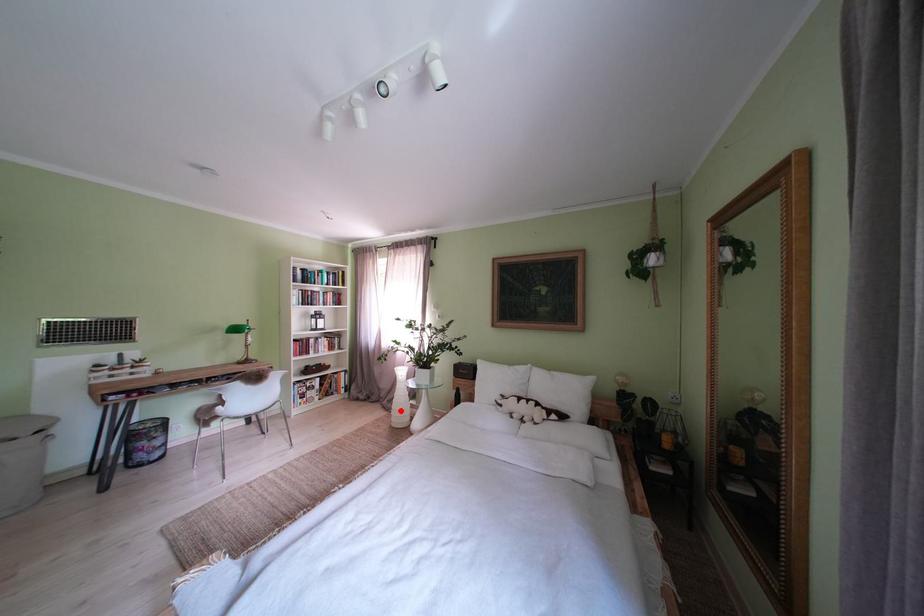
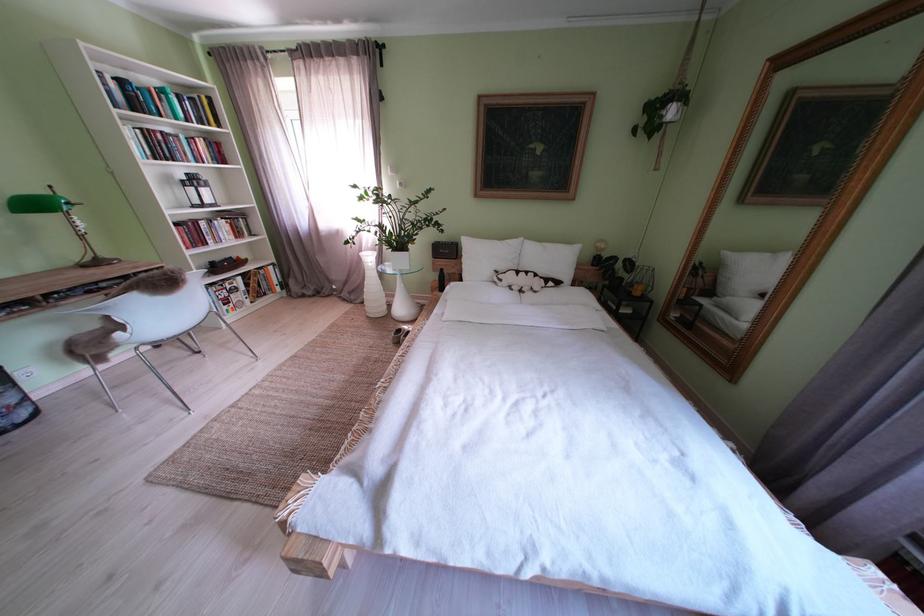
Question: I am providing you with two images of the same scene from different viewpoints. A red point is shown in image1. For the corresponding object point in image2, is it positioned nearer or farther from the camera?

Choices:
 (A) Nearer
 (B) Farther

Answer: (A)